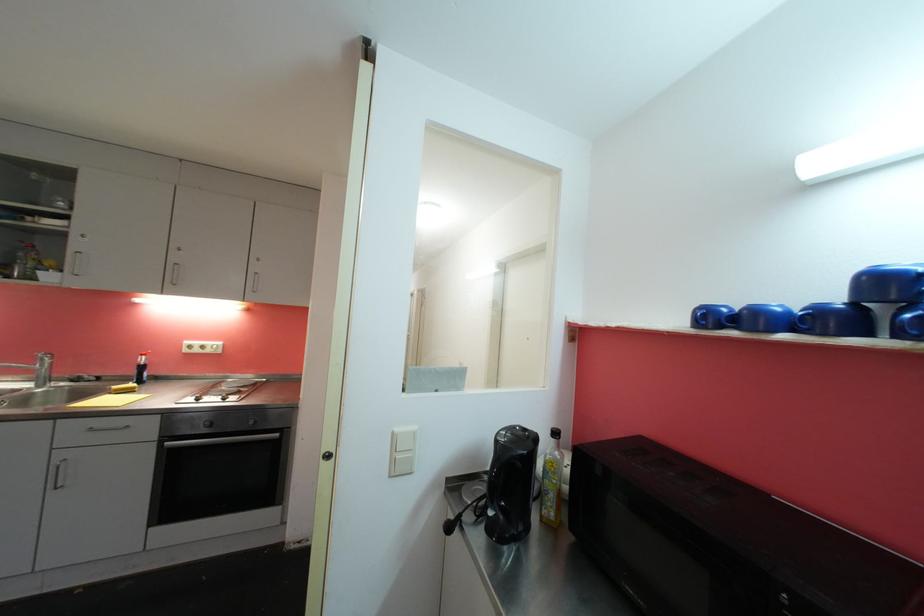
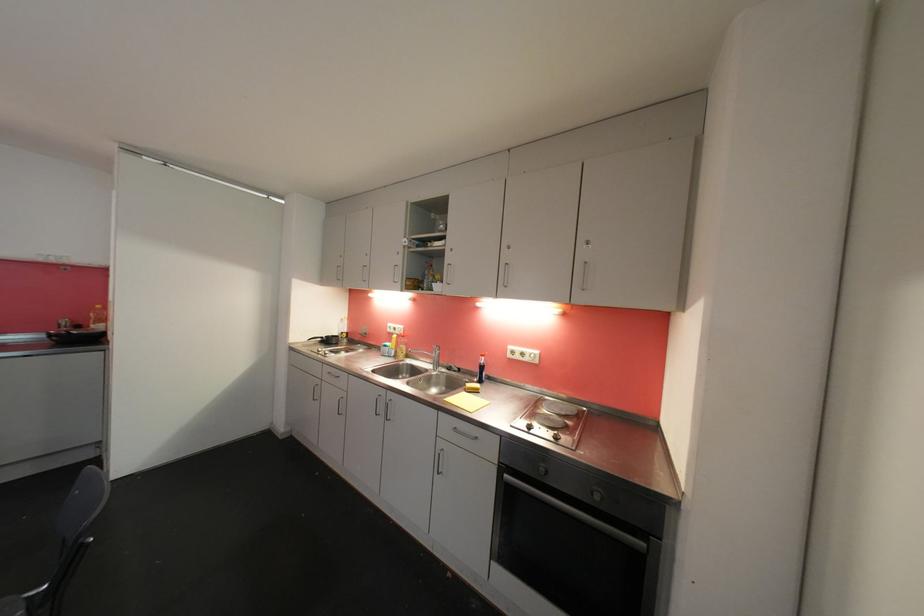
The point at [257,424] is marked in the first image. Where is the corresponding point in the second image?

(602, 499)